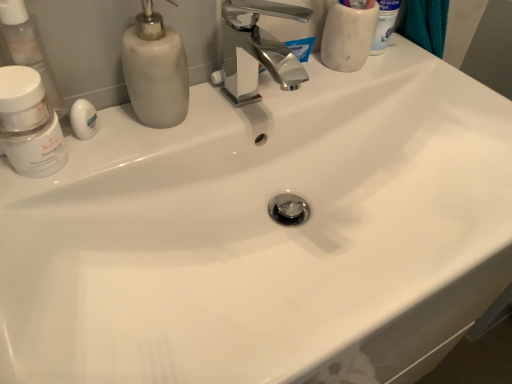
Question: From a real-world perspective, is white marble cup at upper right, which is the first toiletry in back-to-front order, physically located above or below matte white soap dispenser at upper left?

Choices:
 (A) below
 (B) above

Answer: (B)

Question: Based on their sizes in the image, would you say white marble cup at upper right, the 1th toiletry positioned from the top, is bigger or smaller than matte white soap dispenser at upper left?

Choices:
 (A) small
 (B) big

Answer: (B)

Question: Estimate the real-world distances between objects in this image. Which object is farther from the white matte soap at left?

Choices:
 (A) transparent plastic container at left, acting as the 1th toiletry starting from the left
 (B) white matte jar at left
 (C) white marble cup at upper right, the 1th toiletry positioned from the top
 (D) matte white soap dispenser at upper left

Answer: (C)

Question: Which is farther from the white marble cup at upper right, acting as the 2th toiletry starting from the left?

Choices:
 (A) matte white soap dispenser at upper left
 (B) white matte soap at left
 (C) transparent plastic container at left, the 2th toiletry viewed from the right
 (D) white matte jar at left

Answer: (D)